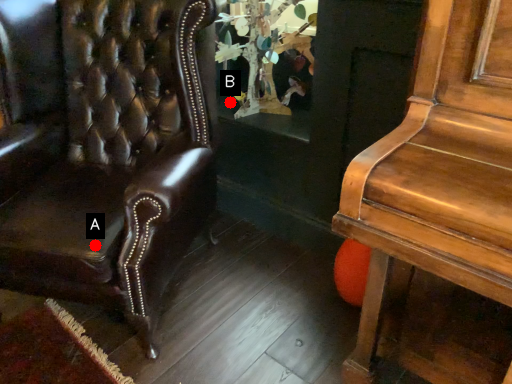
Question: Two points are circled on the image, labeled by A and B beside each circle. Which point is closer to the camera?

Choices:
 (A) A is closer
 (B) B is closer

Answer: (A)